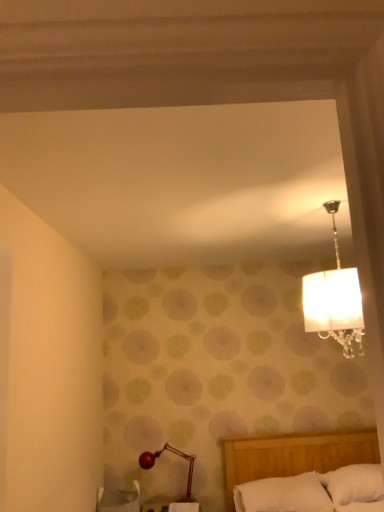
Question: From the image's perspective, is white woven basket at lower left above shiny red lamp at lower left?

Choices:
 (A) no
 (B) yes

Answer: (A)

Question: Is white woven basket at lower left wider than shiny red lamp at lower left?

Choices:
 (A) yes
 (B) no

Answer: (A)

Question: From the image's perspective, is white woven basket at lower left below shiny red lamp at lower left?

Choices:
 (A) no
 (B) yes

Answer: (B)

Question: From a real-world perspective, is white woven basket at lower left positioned over shiny red lamp at lower left based on gravity?

Choices:
 (A) yes
 (B) no

Answer: (B)

Question: Is white woven basket at lower left positioned behind shiny red lamp at lower left?

Choices:
 (A) no
 (B) yes

Answer: (A)

Question: Would you say shiny red lamp at lower left is inside or outside white soft pillow at lower center, which is the 2th pillow from right to left?

Choices:
 (A) outside
 (B) inside

Answer: (A)

Question: Considering the positions of shiny red lamp at lower left and white soft pillow at lower center, the 1th pillow viewed from the left, in the image, is shiny red lamp at lower left bigger or smaller than white soft pillow at lower center, the 1th pillow viewed from the left,?

Choices:
 (A) small
 (B) big

Answer: (A)

Question: From a real-world perspective, is shiny red lamp at lower left positioned above or below white soft pillow at lower center, which is the 2th pillow from right to left?

Choices:
 (A) above
 (B) below

Answer: (A)

Question: Is point (150, 454) closer or farther from the camera than point (240, 494)?

Choices:
 (A) closer
 (B) farther

Answer: (B)

Question: Choose the correct answer: Is white soft pillow at lower right, arranged as the 1th pillow when viewed from the right, inside white soft pillow at lower center, which is the 2th pillow from right to left, or outside it?

Choices:
 (A) outside
 (B) inside

Answer: (A)

Question: In terms of size, does white soft pillow at lower right, arranged as the 1th pillow when viewed from the right, appear bigger or smaller than white soft pillow at lower center, which is the 2th pillow from right to left?

Choices:
 (A) big
 (B) small

Answer: (B)

Question: From the image's perspective, is white soft pillow at lower right, marked as the second pillow in a left-to-right arrangement, positioned above or below white soft pillow at lower center, which is the 2th pillow from right to left?

Choices:
 (A) below
 (B) above

Answer: (B)

Question: From a real-world perspective, is white soft pillow at lower right, arranged as the 1th pillow when viewed from the right, positioned above or below white soft pillow at lower center, which is the 2th pillow from right to left?

Choices:
 (A) above
 (B) below

Answer: (A)

Question: Relative to white woven basket at lower left, is shiny red lamp at lower left in front or behind?

Choices:
 (A) behind
 (B) front

Answer: (A)

Question: In terms of width, does shiny red lamp at lower left look wider or thinner when compared to white woven basket at lower left?

Choices:
 (A) thin
 (B) wide

Answer: (A)